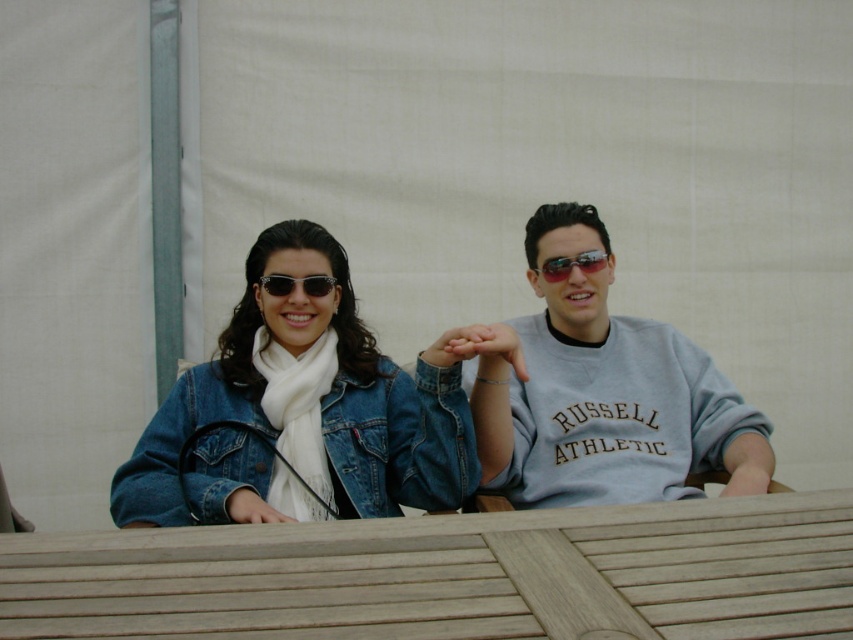
Question: Does matte gray sweatshirt at center have a smaller size compared to sunglasses at center?

Choices:
 (A) no
 (B) yes

Answer: (A)

Question: Estimate the real-world distances between objects in this image. Which object is closer to the sunglasses at center?

Choices:
 (A) matte gray sweatshirt at center
 (B) denim jacket at center
 (C) matte black sunglasses at center

Answer: (A)

Question: Which point is closer to the camera?

Choices:
 (A) (389, 467)
 (B) (601, 269)
 (C) (263, 275)
 (D) (573, 262)

Answer: (A)

Question: Can you confirm if matte gray sweatshirt at center is smaller than matte black sunglasses at center?

Choices:
 (A) yes
 (B) no

Answer: (B)

Question: Can you confirm if sunglasses at center is positioned below matte black sunglasses at center?

Choices:
 (A) yes
 (B) no

Answer: (B)

Question: Estimate the real-world distances between objects in this image. Which object is closer to the matte gray sweatshirt at center?

Choices:
 (A) sunglasses at center
 (B) matte black sunglasses at center

Answer: (A)